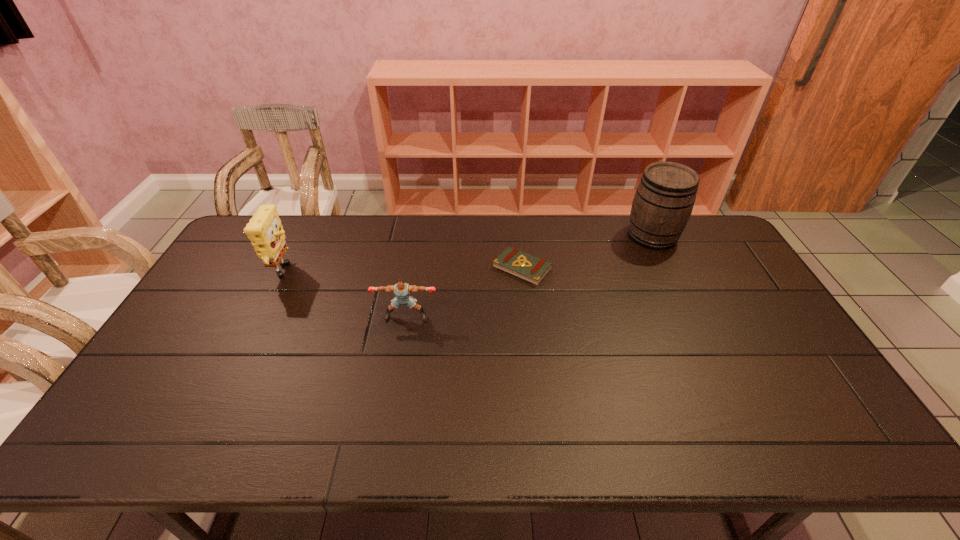
Identify which object is located as the second nearest to the puncher. Please provide its 2D coordinates. Your answer should be formatted as a tuple, i.e. [(x, y)], where the tuple contains the x and y coordinates of a point satisfying the conditions above.

[(264, 230)]

Find the location of a particular element. The width and height of the screenshot is (960, 540). object that is the second nearest to the wine bucket is located at coordinates (402, 290).